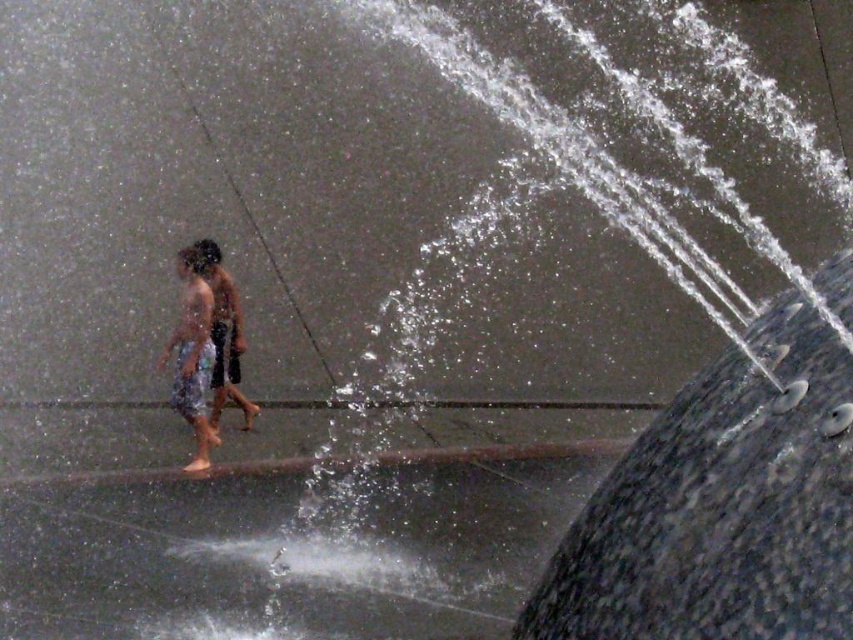
Does white cotton shorts at left lie behind shiny metallic shorts at center?

That is False.

Locate an element on the screen. white cotton shorts at left is located at coordinates (193, 353).

Between point (200, 378) and point (210, 257), which one is positioned behind?

The point (210, 257) is behind.

At what (x,y) coordinates should I click in order to perform the action: click on white cotton shorts at left. Please return your answer as a coordinate pair (x, y). Image resolution: width=853 pixels, height=640 pixels. Looking at the image, I should click on (193, 353).